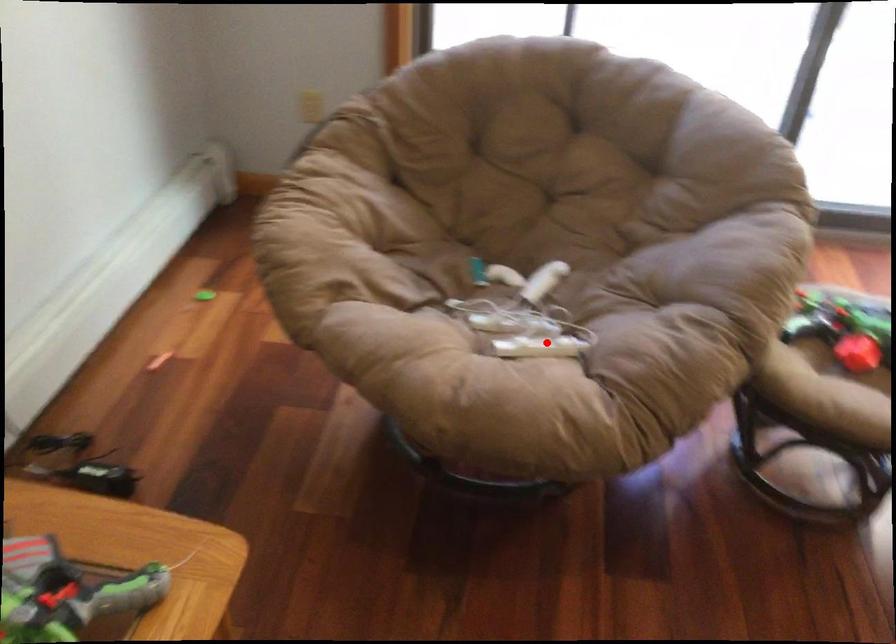
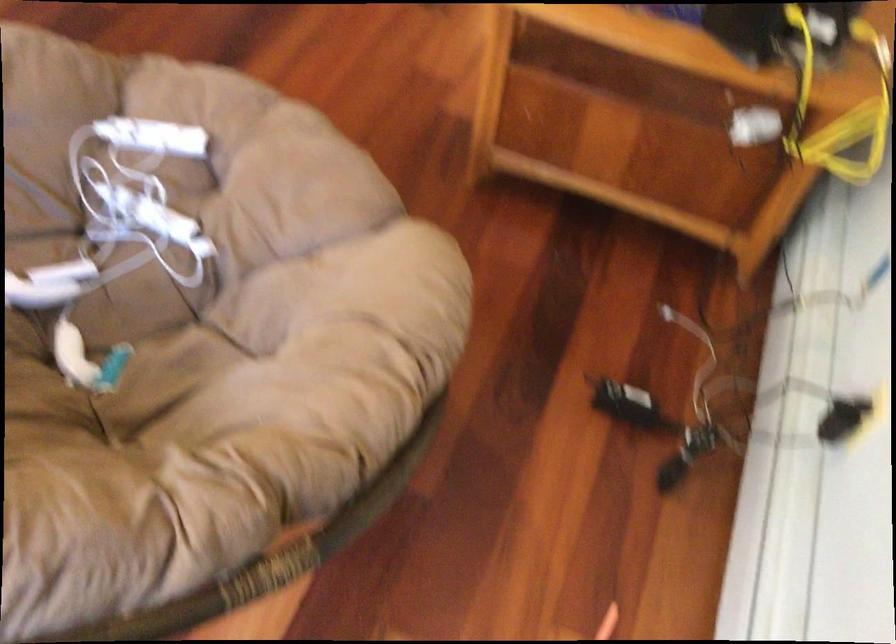
Find the pixel in the second image that matches the highlighted location in the first image.

(152, 137)